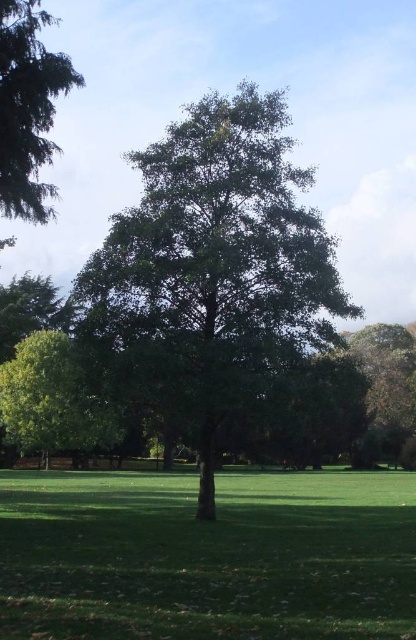
Based on the photo, does green grass at center have a larger size compared to green leafy tree at center?

Incorrect, green grass at center is not larger than green leafy tree at center.

Is green grass at center thinner than green leafy tree at center?

No.

Where is `green grass at center`? The width and height of the screenshot is (416, 640). green grass at center is located at coordinates (207, 556).

Who is positioned more to the right, green grass at center or green leafy tree at right?

green leafy tree at right

At what (x,y) coordinates should I click in order to perform the action: click on green grass at center. Please return your answer as a coordinate pair (x, y). This screenshot has height=640, width=416. Looking at the image, I should click on (207, 556).

This screenshot has width=416, height=640. Identify the location of green grass at center. (207, 556).

Does green leafy tree at lower left come behind green leafy tree at right?

That is False.

Can you confirm if green leafy tree at lower left is smaller than green leafy tree at right?

Correct, green leafy tree at lower left occupies less space than green leafy tree at right.

Locate an element on the screen. green leafy tree at lower left is located at coordinates (52, 400).